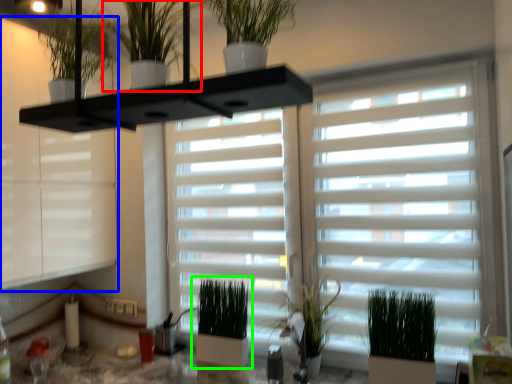
Question: Which is nearer to the houseplant (highlighted by a red box)? window frame (highlighted by a blue box) or houseplant (highlighted by a green box).

Choices:
 (A) window frame
 (B) houseplant

Answer: (A)